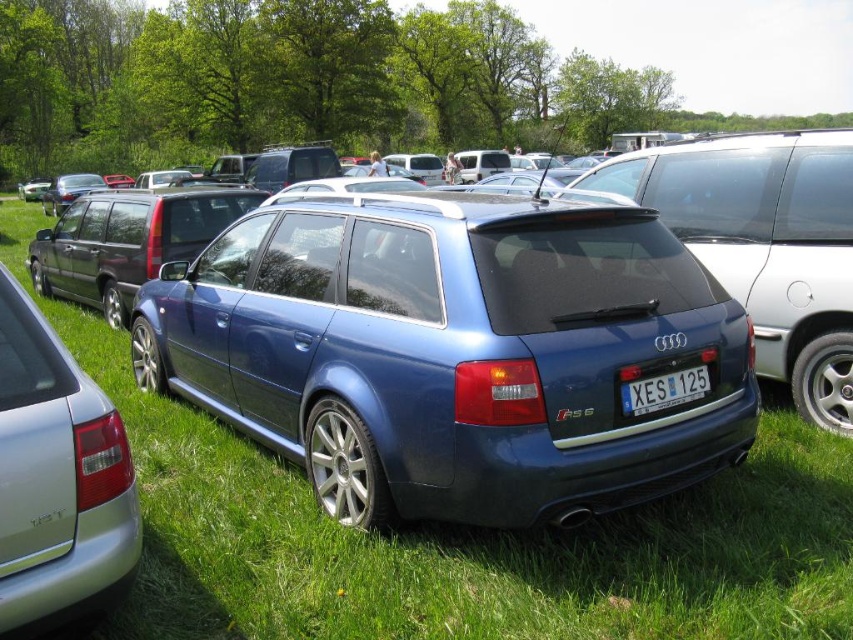
You are a photographer planning to take a group photo of the metallic blue station wagon at center and the matte black minivan at center. Which vehicle should you position closer to the camera to ensure both appear the same width in the photo?

You should position the metallic blue station wagon at center closer to the camera because it is thinner than the matte black minivan at center. This way, the thinner wagon will appear wider in the photo, balancing the visual width with the minivan which is farther but wider in actual size.

You are standing at the camera position and want to take a photo of the satin silver sedan at lower left. Is it possible to capture the entire sedan in the frame without moving the camera?

The satin silver sedan at lower left and camera are 7.01 feet apart from each other. Since the distance is sufficient for capturing the entire sedan in the frame without moving the camera, yes, it is possible.

You are standing at the center of the field where the car meet is happening. You want to find the satin silver sedan at lower left. Based on the coordinates provided, in which direction should you look to locate it?

The satin silver sedan at lower left is located at coordinates point (57, 476), which means it is positioned to the lower left from your current position at the center of the field.